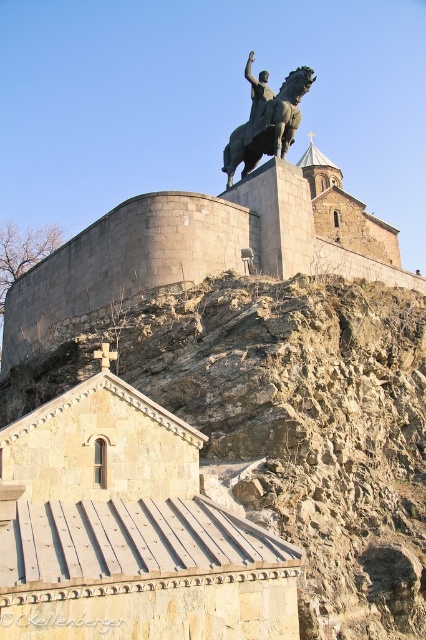
Question: Which object is closer to the camera taking this photo?

Choices:
 (A) brown rocky hillside at upper center
 (B) bronze statue at upper center

Answer: (A)

Question: Among these objects, which one is farthest from the camera?

Choices:
 (A) brown rocky hillside at upper center
 (B) bronze statue at upper center

Answer: (B)

Question: Where is brown rocky hillside at upper center located in relation to bronze statue at upper center in the image?

Choices:
 (A) above
 (B) below

Answer: (B)

Question: Is brown rocky hillside at upper center above bronze statue at upper center?

Choices:
 (A) no
 (B) yes

Answer: (A)

Question: Does brown rocky hillside at upper center have a lesser width compared to bronze statue at upper center?

Choices:
 (A) yes
 (B) no

Answer: (B)